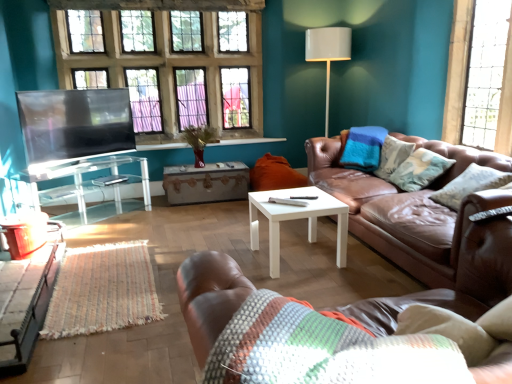
Question: Is transparent glass table at left, which is the second table from front to back, facing towards textured beige pillow at right, which is the 2th pillow in left-to-right order?

Choices:
 (A) no
 (B) yes

Answer: (B)

Question: Does transparent glass table at left, marked as the second table in a back-to-front arrangement, contain textured beige pillow at right, the first pillow when ordered from right to left?

Choices:
 (A) yes
 (B) no

Answer: (B)

Question: From a real-world perspective, is transparent glass table at left, marked as the second table in a back-to-front arrangement, over textured beige pillow at right, which appears as the second pillow when viewed from the back?

Choices:
 (A) no
 (B) yes

Answer: (A)

Question: From a real-world perspective, is transparent glass table at left, which is the second table from front to back, beneath textured beige pillow at right, the first pillow when ordered from right to left?

Choices:
 (A) no
 (B) yes

Answer: (B)

Question: Does transparent glass table at left, which is the second table from front to back, come in front of textured beige pillow at right, which is the 2th pillow in left-to-right order?

Choices:
 (A) no
 (B) yes

Answer: (A)

Question: Considering the relative positions of transparent glass table at left, marked as the second table in a back-to-front arrangement, and textured beige pillow at right, the first pillow when ordered from right to left, in the image provided, is transparent glass table at left, marked as the second table in a back-to-front arrangement, to the right of textured beige pillow at right, the first pillow when ordered from right to left, from the viewer's perspective?

Choices:
 (A) no
 (B) yes

Answer: (A)

Question: From a real-world perspective, is brown leather couch at right, which is the second studio couch from left to right, on top of clear glass windows at upper left, positioned as the second window in front-to-back order?

Choices:
 (A) yes
 (B) no

Answer: (B)

Question: Does brown leather couch at right, which appears as the first studio couch when viewed from the right, appear on the right side of clear glass windows at upper left, the second window when ordered from right to left?

Choices:
 (A) yes
 (B) no

Answer: (A)

Question: Does brown leather couch at right, which ranks as the first studio couch in back-to-front order, have a larger size compared to clear glass windows at upper left, marked as the 1th window in a left-to-right arrangement?

Choices:
 (A) yes
 (B) no

Answer: (A)

Question: Is brown leather couch at right, positioned as the second studio couch in front-to-back order, taller than clear glass windows at upper left, the second window when ordered from right to left?

Choices:
 (A) yes
 (B) no

Answer: (B)

Question: Does brown leather couch at right, which ranks as the first studio couch in back-to-front order, lie behind clear glass windows at upper left, positioned as the second window in front-to-back order?

Choices:
 (A) yes
 (B) no

Answer: (B)

Question: Is brown leather couch at right, positioned as the second studio couch in front-to-back order, next to clear glass windows at upper left, acting as the first window starting from the back, and touching it?

Choices:
 (A) no
 (B) yes

Answer: (A)

Question: Is white glossy floor lamp at upper right oriented away from clear glass windows at upper left, marked as the 1th window in a left-to-right arrangement?

Choices:
 (A) no
 (B) yes

Answer: (A)